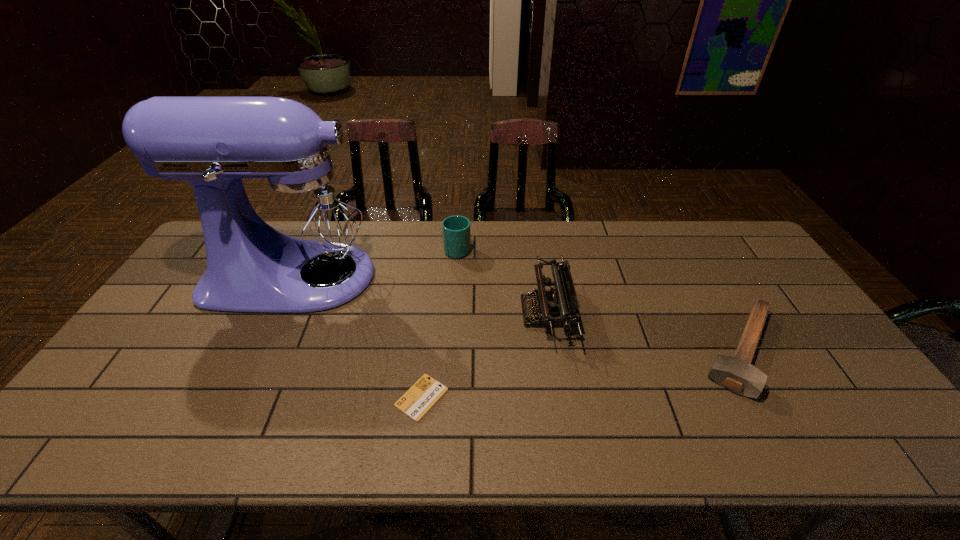
Image resolution: width=960 pixels, height=540 pixels. In order to click on free area in between the rightmost object and the identity card in this screenshot , I will do `click(582, 374)`.

You are a GUI agent. You are given a task and a screenshot of the screen. Output one action in this format:
    pyautogui.click(x=<x>, y=<y>)
    Task: Click on the free space between the second object from right to left and the mixer
    Image resolution: width=960 pixels, height=540 pixels.
    Given the screenshot: What is the action you would take?
    pyautogui.click(x=421, y=295)

This screenshot has width=960, height=540. Identify the location of empty space that is in between the typewriter and the cup. (502, 280).

Where is `vacant point located between the second shortest object and the cup`? vacant point located between the second shortest object and the cup is located at coordinates (600, 299).

Identify the location of empty location between the rightmost object and the identity card. The height and width of the screenshot is (540, 960). (582, 374).

This screenshot has width=960, height=540. What are the coordinates of `free spot between the cup and the shortest object` in the screenshot? It's located at (440, 323).

Identify which object is the closest to the tallest object. Please provide its 2D coordinates. Your answer should be formatted as a tuple, i.e. [(x, y)], where the tuple contains the x and y coordinates of a point satisfying the conditions above.

[(456, 231)]

The height and width of the screenshot is (540, 960). What are the coordinates of `the second closest object to the identity card` in the screenshot? It's located at (296, 239).

Find the location of a particular element. free spot that satisfies the following two spatial constraints: 1. at the mixing area of the leftmost object; 2. on the back side of the identity card is located at coordinates (239, 397).

Locate an element on the screen. free spot that satisfies the following two spatial constraints: 1. at the mixing area of the tallest object; 2. on the back side of the fourth tallest object is located at coordinates (261, 350).